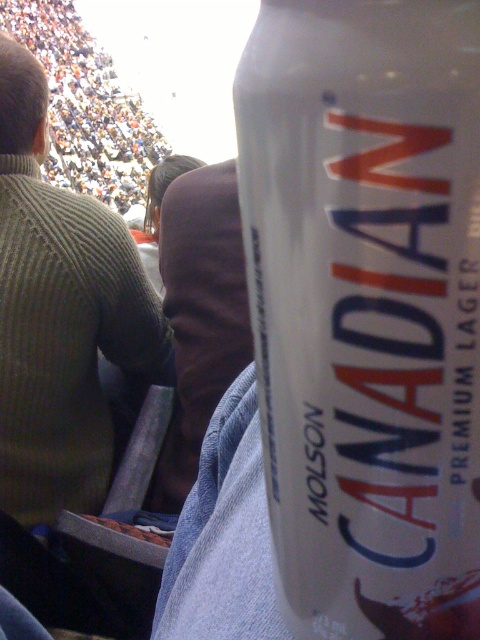
Can you confirm if white matte can at center is smaller than green ribbed sweater at upper left?

Yes, white matte can at center is smaller than green ribbed sweater at upper left.

Between white matte can at center and green ribbed sweater at upper left, which one is positioned higher?

green ribbed sweater at upper left is higher up.

Is point (444, 432) farther from viewer compared to point (78, 264)?

No, it is not.

At what (x,y) coordinates should I click in order to perform the action: click on white matte can at center. Please return your answer as a coordinate pair (x, y). Looking at the image, I should click on (367, 307).